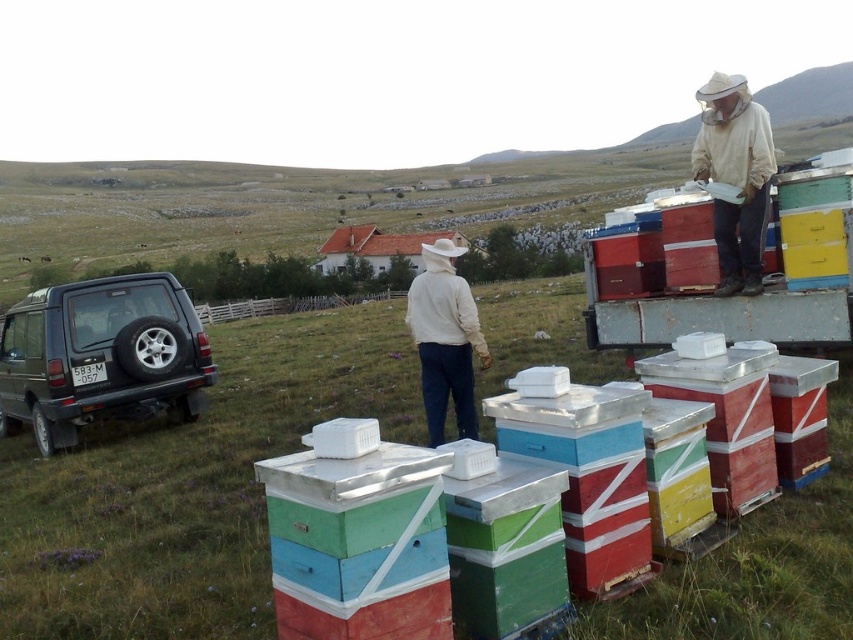
Is dark gray matte suv at lower left wider than white matte jacket at center?

Indeed, dark gray matte suv at lower left has a greater width compared to white matte jacket at center.

Which is below, dark gray matte suv at lower left or white matte jacket at center?

dark gray matte suv at lower left is below.

You are a GUI agent. You are given a task and a screenshot of the screen. Output one action in this format:
    pyautogui.click(x=<x>, y=<y>)
    Task: Click on the dark gray matte suv at lower left
    
    Given the screenshot: What is the action you would take?
    pyautogui.click(x=100, y=355)

Does point (93, 394) come behind point (747, 92)?

Yes.

In the scene shown: Which is more to the left, dark gray matte suv at lower left or white mesh hat at upper right?

From the viewer's perspective, dark gray matte suv at lower left appears more on the left side.

Where is `dark gray matte suv at lower left`? dark gray matte suv at lower left is located at coordinates (100, 355).

I want to click on dark gray matte suv at lower left, so click(100, 355).

Does white mesh hat at upper right have a larger size compared to white matte jacket at center?

Yes.

Between white mesh hat at upper right and white matte jacket at center, which one is positioned higher?

Positioned higher is white mesh hat at upper right.

Describe the element at coordinates (735, 177) in the screenshot. I see `white mesh hat at upper right` at that location.

You are a GUI agent. You are given a task and a screenshot of the screen. Output one action in this format:
    pyautogui.click(x=<x>, y=<y>)
    Task: Click on the white mesh hat at upper right
    This screenshot has height=640, width=853.
    Given the screenshot: What is the action you would take?
    pyautogui.click(x=735, y=177)